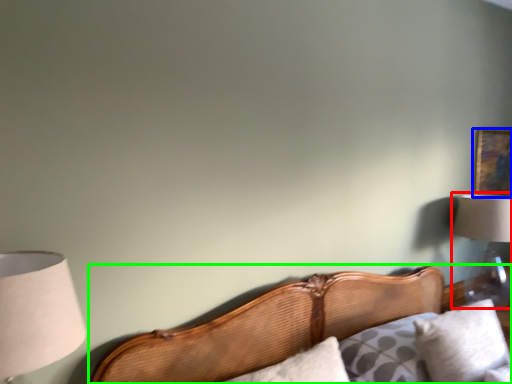
Question: Which object is positioned farthest from lamp (highlighted by a red box)? Select from picture frame (highlighted by a blue box) and bed (highlighted by a green box).

Choices:
 (A) picture frame
 (B) bed

Answer: (B)